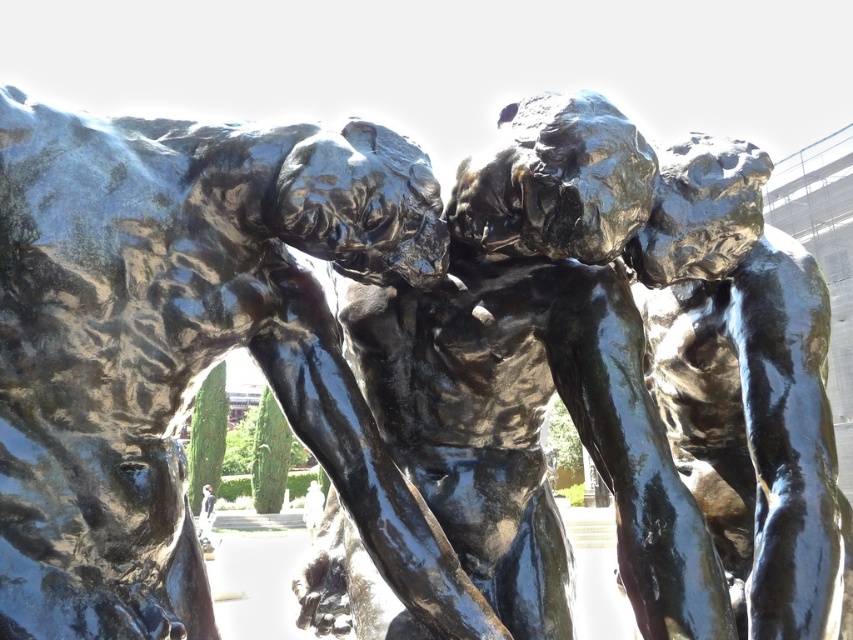
Question: From the image, what is the correct spatial relationship of shiny black sculpture at center in relation to glossy bronze statue at center?

Choices:
 (A) above
 (B) below

Answer: (A)

Question: Does shiny black sculpture at center appear on the left side of shiny bronze torso at center?

Choices:
 (A) no
 (B) yes

Answer: (B)

Question: Which point is farther from the camera taking this photo?

Choices:
 (A) (461, 168)
 (B) (155, 525)
 (C) (817, 481)

Answer: (C)

Question: Which of these objects is positioned farthest from the shiny black sculpture at center?

Choices:
 (A) glossy bronze statue at center
 (B) shiny bronze torso at center

Answer: (B)

Question: Which object appears closest to the camera in this image?

Choices:
 (A) glossy bronze statue at center
 (B) shiny black sculpture at center

Answer: (B)

Question: Does glossy bronze statue at center have a lesser width compared to shiny bronze torso at center?

Choices:
 (A) no
 (B) yes

Answer: (A)